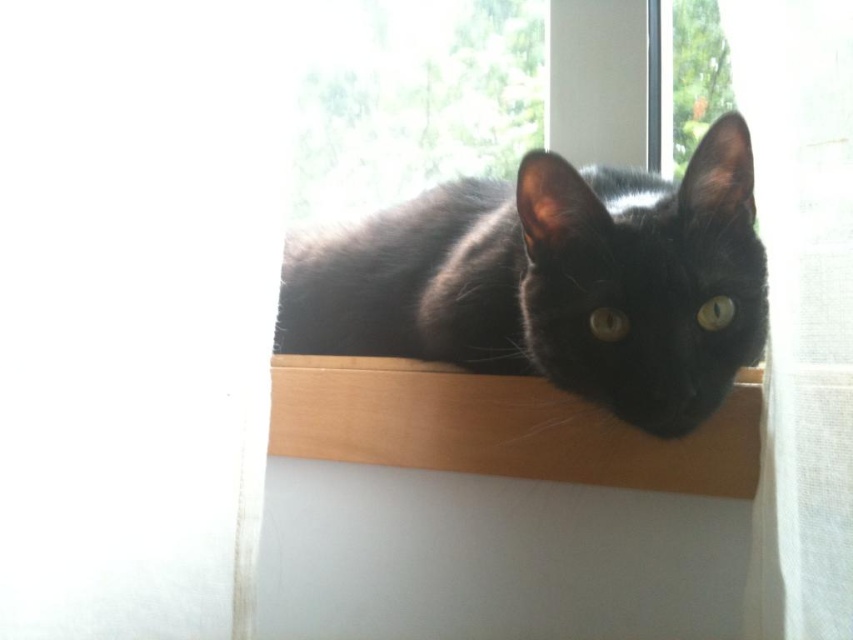
Is black fur cat at center in front of wooden shelf at center?

Yes, black fur cat at center is in front of wooden shelf at center.

Does black fur cat at center have a greater width compared to wooden shelf at center?

Yes.

Who is more distant from viewer, (618, 220) or (437, 364)?

Point (437, 364)

Identify the location of black fur cat at center. (555, 282).